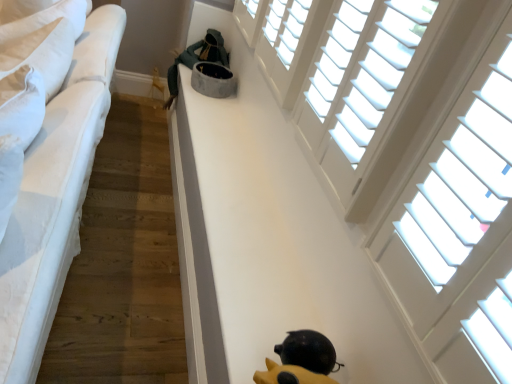
What do you see at coordinates (412, 151) in the screenshot? I see `white wood blinds at upper right, marked as the second window in a back-to-front arrangement` at bounding box center [412, 151].

Locate an element on the screen. The image size is (512, 384). white wood blinds at upper right, marked as the second window in a back-to-front arrangement is located at coordinates (x=412, y=151).

Which of these two, yellow rubber duck at lower center or white wood blinds at upper right, acting as the 1th window starting from the front, is wider?

yellow rubber duck at lower center.

Does point (298, 370) come farther from viewer compared to point (439, 30)?

Yes.

From a real-world perspective, which window is the 2nd one above the yellow rubber duck at lower center? Please provide its 2D coordinates.

[(412, 151)]

Is yellow rubber duck at lower center located outside white fabric bed at left?

Yes, yellow rubber duck at lower center is outside of white fabric bed at left.

The height and width of the screenshot is (384, 512). What are the coordinates of `furniture below the yellow rubber duck at lower center (from a real-world perspective)` in the screenshot? It's located at (54, 198).

Considering the sizes of yellow rubber duck at lower center and white fabric bed at left in the image, is yellow rubber duck at lower center wider or thinner than white fabric bed at left?

Considering their sizes, yellow rubber duck at lower center looks slimmer than white fabric bed at left.

Is yellow rubber duck at lower center to the left of white fabric bed at left from the viewer's perspective?

Incorrect, yellow rubber duck at lower center is not on the left side of white fabric bed at left.

Can you tell me how much white fabric bed at left and yellow rubber duck at lower center differ in facing direction?

There is a 33.7-degree angle between the facing directions of white fabric bed at left and yellow rubber duck at lower center.

Which object is further away from the camera taking this photo, white fabric bed at left or yellow rubber duck at lower center?

yellow rubber duck at lower center is more distant.

Which of these two, white fabric bed at left or yellow rubber duck at lower center, is thinner?

With smaller width is yellow rubber duck at lower center.

From a real-world perspective, which object stands above the other?

yellow rubber duck at lower center.

Would you say white fabric bed at left is to the left or to the right of dark gray plush cat bed at upper center in the picture?

In the image, white fabric bed at left appears on the left side of dark gray plush cat bed at upper center.

From the picture: Relative to dark gray plush cat bed at upper center, is white fabric bed at left in front or behind?

In the image, white fabric bed at left appears in front of dark gray plush cat bed at upper center.

Is white fabric bed at left smaller than dark gray plush cat bed at upper center?

No.

From the picture: Is dark gray plush cat bed at upper center at the back of white fabric bed at left?

Absolutely, white fabric bed at left is directed away from dark gray plush cat bed at upper center.

Is white wood blinds at upper right, acting as the 1th window starting from the front, oriented towards yellow rubber duck at lower center?

No, white wood blinds at upper right, acting as the 1th window starting from the front, is not turned towards yellow rubber duck at lower center.

Between white wood blinds at upper right, acting as the 1th window starting from the front, and yellow rubber duck at lower center, which one is positioned behind?

Positioned behind is yellow rubber duck at lower center.

Which is in front, point (399, 69) or point (310, 338)?

The point (399, 69) is closer to the camera.

Image resolution: width=512 pixels, height=384 pixels. Identify the location of toy that appears below the white wood blinds at upper right, acting as the 1th window starting from the front (from a real-world perspective). (301, 360).

Which is behind, yellow rubber duck at lower center or white wood blinds at upper right, which is counted as the first window, starting from the back?

white wood blinds at upper right, which is counted as the first window, starting from the back.

From a real-world perspective, is yellow rubber duck at lower center on top of white wood blinds at upper right, which is the second window in front-to-back order?

No.

Can you confirm if yellow rubber duck at lower center is bigger than white wood blinds at upper right, which is the second window in front-to-back order?

Incorrect, yellow rubber duck at lower center is not larger than white wood blinds at upper right, which is the second window in front-to-back order.

Is point (295, 331) in front of point (434, 7)?

No, (295, 331) is further to viewer.

Is yellow rubber duck at lower center next to dark gray plush cat bed at upper center and touching it?

No, yellow rubber duck at lower center is not with dark gray plush cat bed at upper center.

Is point (281, 365) closer or farther from the camera than point (188, 63)?

Clearly, point (281, 365) is closer to the camera than point (188, 63).

Is yellow rubber duck at lower center to the right of dark gray plush cat bed at upper center from the viewer's perspective?

Indeed, yellow rubber duck at lower center is positioned on the right side of dark gray plush cat bed at upper center.

From a real-world perspective, who is located lower, yellow rubber duck at lower center or dark gray plush cat bed at upper center?

dark gray plush cat bed at upper center.

What are the coordinates of `toy lying behind the white wood blinds at upper right, acting as the 1th window starting from the front` in the screenshot? It's located at (301, 360).

The width and height of the screenshot is (512, 384). In order to click on furniture in front of the yellow rubber duck at lower center in this screenshot , I will do `click(54, 198)`.

Which object lies further to the anchor point dark gray plush cat bed at upper center, white fabric bed at left or white wood blinds at upper right, marked as the second window in a back-to-front arrangement?

white wood blinds at upper right, marked as the second window in a back-to-front arrangement.

From the image, which object appears to be nearer to dark gray plush cat bed at upper center, white fabric bed at left or white wood blinds at upper right, which is counted as the first window, starting from the back?

Based on the image, white fabric bed at left appears to be nearer to dark gray plush cat bed at upper center.

When comparing their distances from white wood blinds at upper right, which is counted as the first window, starting from the back, does yellow rubber duck at lower center or white fabric bed at left seem further?

white fabric bed at left.

Based on their spatial positions, is white wood blinds at upper right, which is the second window in front-to-back order, or white fabric bed at left closer to yellow rubber duck at lower center?

white wood blinds at upper right, which is the second window in front-to-back order, is closer to yellow rubber duck at lower center.

Which object lies nearer to the anchor point white wood blinds at upper right, marked as the second window in a back-to-front arrangement, yellow rubber duck at lower center or white fabric bed at left?

The object closer to white wood blinds at upper right, marked as the second window in a back-to-front arrangement, is yellow rubber duck at lower center.

In the scene shown: When comparing their distances from white wood blinds at upper right, which is counted as the first window, starting from the back, does white fabric bed at left or dark gray plush cat bed at upper center seem further?

Based on the image, dark gray plush cat bed at upper center appears to be further to white wood blinds at upper right, which is counted as the first window, starting from the back.

Considering their positions, is dark gray plush cat bed at upper center positioned further to white fabric bed at left than yellow rubber duck at lower center?

dark gray plush cat bed at upper center is further to white fabric bed at left.

Considering their positions, is yellow rubber duck at lower center positioned further to white fabric bed at left than dark gray plush cat bed at upper center?

Among the two, dark gray plush cat bed at upper center is located further to white fabric bed at left.

This screenshot has height=384, width=512. Find the location of `window situated between white fabric bed at left and white wood blinds at upper right, acting as the 1th window starting from the front, from left to right`. window situated between white fabric bed at left and white wood blinds at upper right, acting as the 1th window starting from the front, from left to right is located at coordinates (379, 75).

Locate an element on the screen. The image size is (512, 384). toy between white fabric bed at left and dark gray plush cat bed at upper center along the z-axis is located at coordinates (301, 360).

Identify the location of window positioned between white wood blinds at upper right, marked as the second window in a back-to-front arrangement, and dark gray plush cat bed at upper center from near to far. The image size is (512, 384). (379, 75).

Where is `toy between white fabric bed at left and white wood blinds at upper right, acting as the 1th window starting from the front`? Image resolution: width=512 pixels, height=384 pixels. toy between white fabric bed at left and white wood blinds at upper right, acting as the 1th window starting from the front is located at coordinates (301, 360).